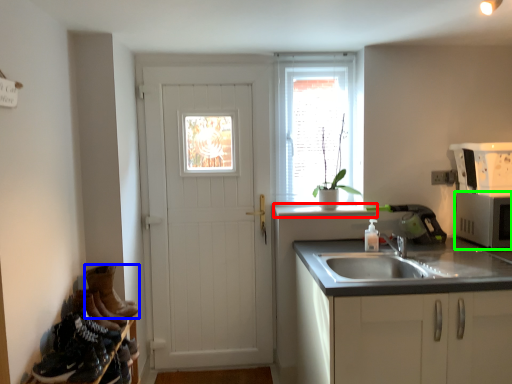
Question: Estimate the real-world distances between objects in this image. Which object is closer to window sill (highlighted by a red box), footwear (highlighted by a blue box) or appliance (highlighted by a green box)?

Choices:
 (A) footwear
 (B) appliance

Answer: (B)